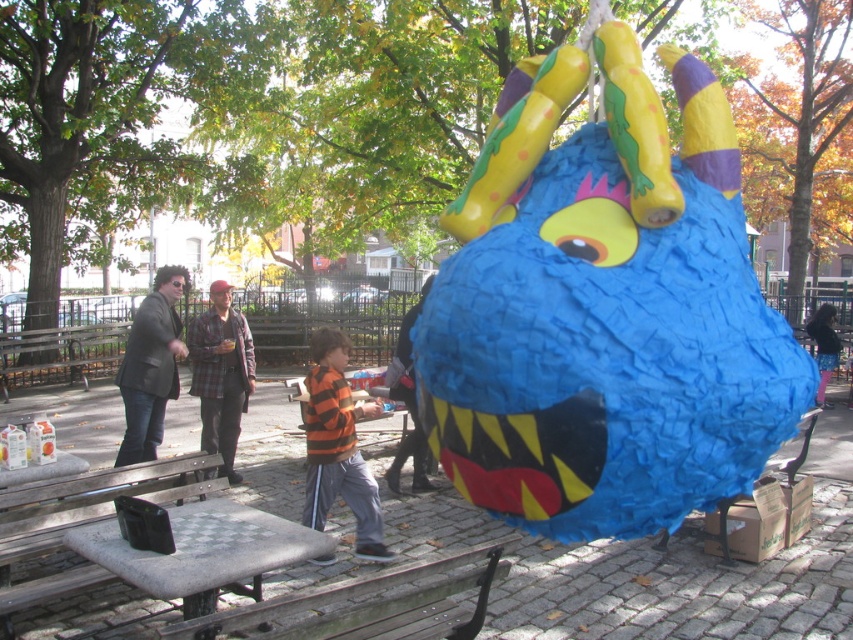
Does wooden park bench at lower left have a greater height compared to wooden park bench at center?

Correct, wooden park bench at lower left is much taller as wooden park bench at center.

This screenshot has width=853, height=640. Describe the element at coordinates (82, 520) in the screenshot. I see `wooden park bench at lower left` at that location.

Where is `wooden park bench at lower left`? wooden park bench at lower left is located at coordinates (82, 520).

Where is `gray concrete picnic table at lower left`? gray concrete picnic table at lower left is located at coordinates (202, 552).

Can you confirm if gray concrete picnic table at lower left is taller than wooden park bench at lower left?

In fact, gray concrete picnic table at lower left may be shorter than wooden park bench at lower left.

Is point (177, 572) positioned in front of point (85, 497)?

Yes, point (177, 572) is in front of point (85, 497).

Where is `gray concrete picnic table at lower left`? gray concrete picnic table at lower left is located at coordinates (202, 552).

Measure the distance between wooden bench at lower left and camera.

wooden bench at lower left and camera are 2.21 meters apart from each other.

Does point (380, 586) come farther from viewer compared to point (146, 488)?

No.

This screenshot has width=853, height=640. In order to click on wooden bench at lower left in this screenshot , I will do `click(367, 604)`.

At what (x,y) coordinates should I click in order to perform the action: click on wooden bench at lower left. Please return your answer as a coordinate pair (x, y). Looking at the image, I should click on (367, 604).